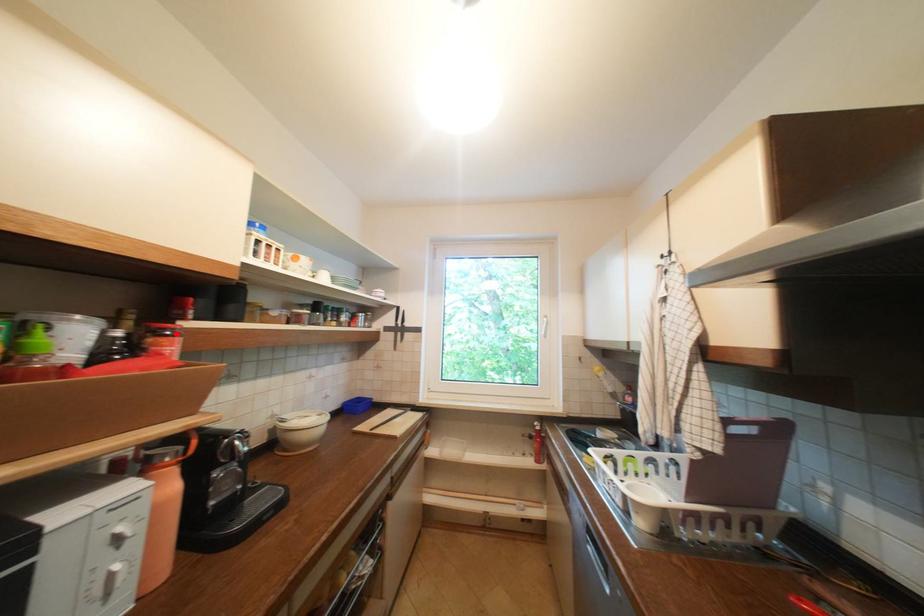
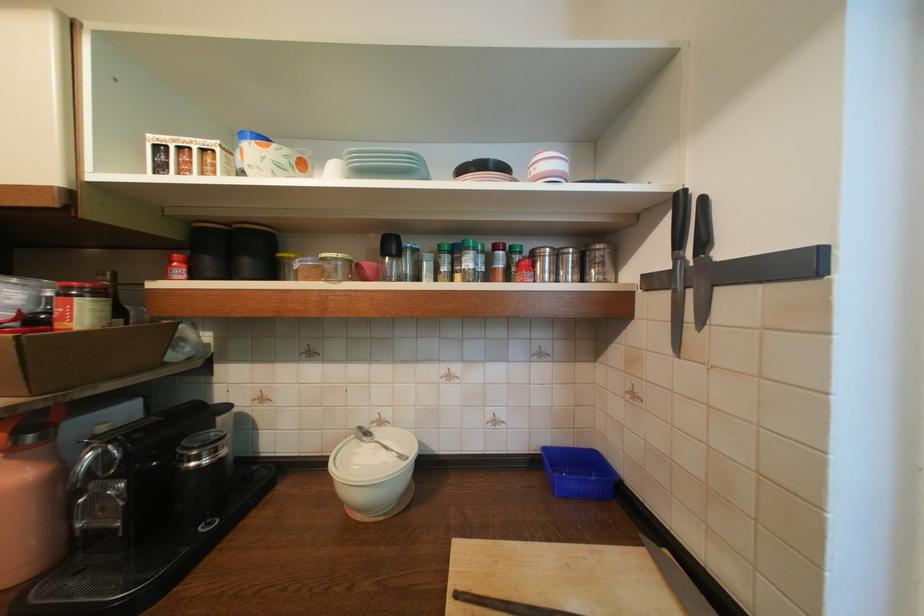
Find the pixel in the second image that matches the highlighted location in the first image.

(82, 294)